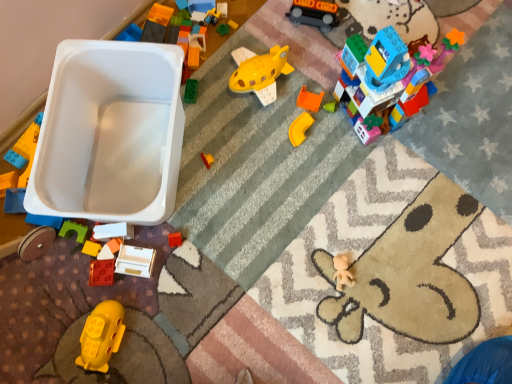
You are a GUI agent. You are given a task and a screenshot of the screen. Output one action in this format:
    pyautogui.click(x=<x>, y=<y>)
    Task: Click on the free space that is in between yellow matte toy submarine at lower left, which is counted as the eighth toy, starting from the top, and matte white drawer at lower center, the 6th toy from the top
    The width and height of the screenshot is (512, 384).
    Given the screenshot: What is the action you would take?
    pyautogui.click(x=123, y=295)